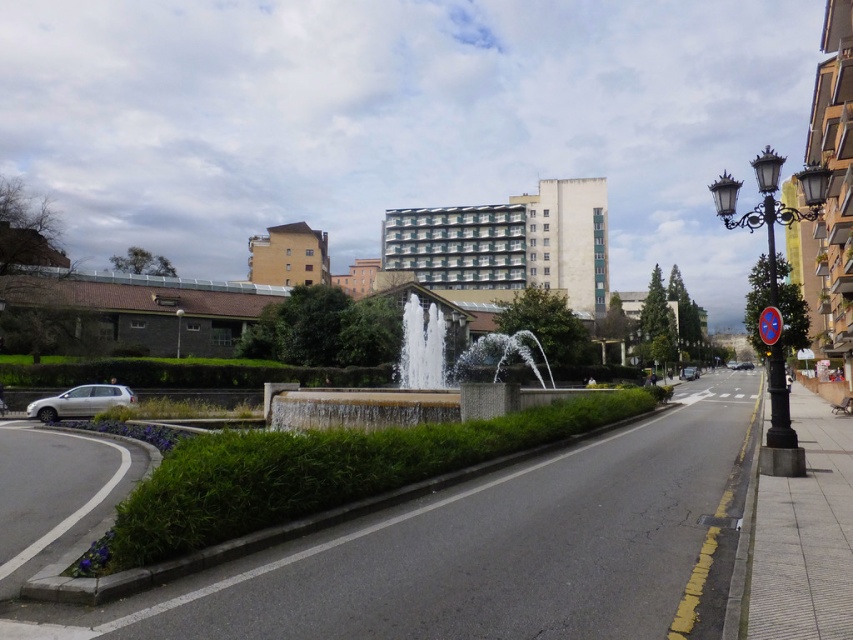
Image resolution: width=853 pixels, height=640 pixels. What do you see at coordinates (398, 394) in the screenshot? I see `white stone fountain at center` at bounding box center [398, 394].

In order to click on white stone fountain at center in this screenshot , I will do `click(398, 394)`.

Who is positioned more to the right, silver metallic car at left or metallic silver car at center?

metallic silver car at center

Which is in front, point (73, 416) or point (686, 371)?

Point (73, 416) is in front.

You are a GUI agent. You are given a task and a screenshot of the screen. Output one action in this format:
    pyautogui.click(x=<x>, y=<y>)
    Task: Click on the silver metallic car at left
    
    Given the screenshot: What is the action you would take?
    pyautogui.click(x=80, y=401)

The image size is (853, 640). Find the location of `silver metallic car at left`. silver metallic car at left is located at coordinates (80, 401).

Is point (425, 420) closer to camera compared to point (850, 186)?

Yes, point (425, 420) is in front of point (850, 186).

Find the location of a particular element. white stone fountain at center is located at coordinates (398, 394).